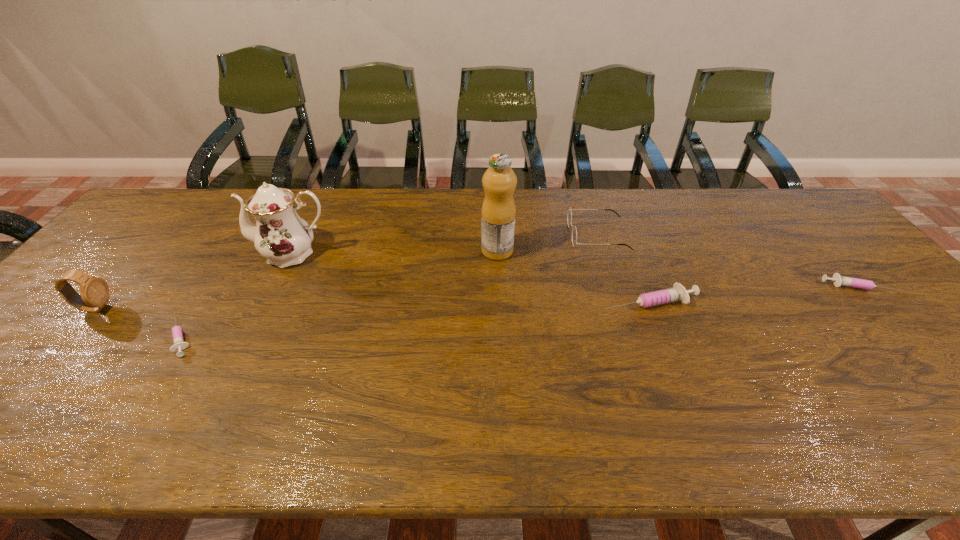
In the image, there is a desktop. At what (x,y) coordinates should I click in order to perform the action: click on vacant space at the right edge. Please return your answer as a coordinate pair (x, y). The height and width of the screenshot is (540, 960). Looking at the image, I should click on (814, 271).

In the image, there is a desktop. Where is `vacant space at the far left corner`? Image resolution: width=960 pixels, height=540 pixels. vacant space at the far left corner is located at coordinates (184, 199).

Locate an element on the screen. The height and width of the screenshot is (540, 960). free region at the far right corner of the desktop is located at coordinates (771, 201).

Where is `free area in between the chinaware and the leftmost object`? free area in between the chinaware and the leftmost object is located at coordinates (194, 281).

I want to click on vacant space that is in between the sixth tallest object and the third shortest object, so click(x=753, y=294).

Find the location of a particular element. The image size is (960, 540). free space between the leftmost object and the sixth shortest object is located at coordinates (194, 281).

Identify the location of unoccupied area between the sixth tallest object and the fifth shortest object. (476, 298).

This screenshot has height=540, width=960. In order to click on unoccupied position between the fourth object from left to right and the sixth tallest object in this screenshot , I will do `click(678, 268)`.

Find the location of a particular element. The height and width of the screenshot is (540, 960). free spot between the watch and the second object from left to right is located at coordinates (138, 322).

This screenshot has height=540, width=960. What are the coordinates of `vacant area that lies between the shortest object and the tallest object` in the screenshot? It's located at (339, 294).